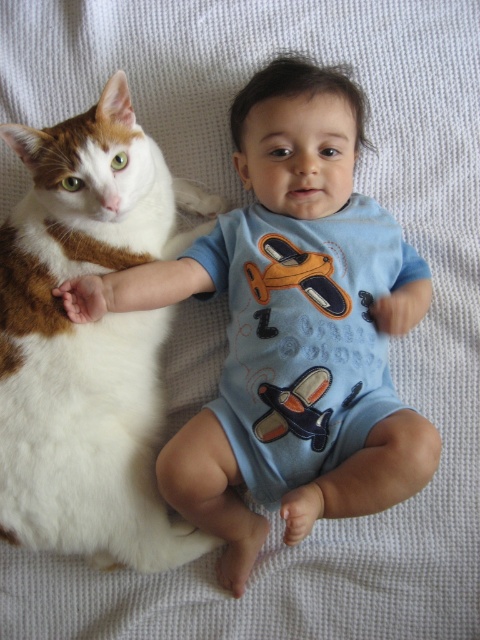
You are a photographer taking a picture of the baby and cat on the white blanket. You notice a point at coordinates (296,330). What object is located at this point?

The point at coordinates 0.561, 0.617 marks the blue cotton onesie at center.

You are a parent checking on your baby and the cat. You notice both the white fluffy cat at left and the white fur paw at left in your view. Which one is nearer to you?

The white fluffy cat at left is closer to the viewer than the white fur paw at left.

You are a parent looking at your baby and cat lying on the blanket. You need to place a small toy between the blue cotton onesie at center and the white fur paw at left. Based on their positions, where should you place the toy?

The blue cotton onesie at center is located below the white fur paw at left, so you should place the toy between them by positioning it above the blue cotton onesie at center and below the white fur paw at left.